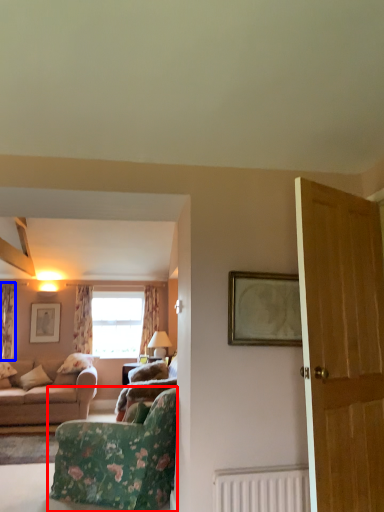
Question: Which point is further to the camera, chair (highlighted by a red box) or curtain (highlighted by a blue box)?

Choices:
 (A) chair
 (B) curtain

Answer: (B)